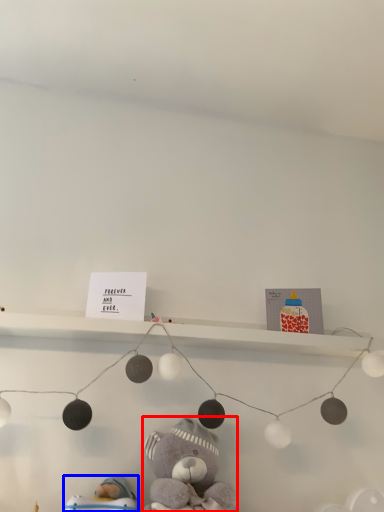
Question: Which object is further to the camera taking this photo, teddy bear (highlighted by a red box) or toy (highlighted by a blue box)?

Choices:
 (A) teddy bear
 (B) toy

Answer: (B)